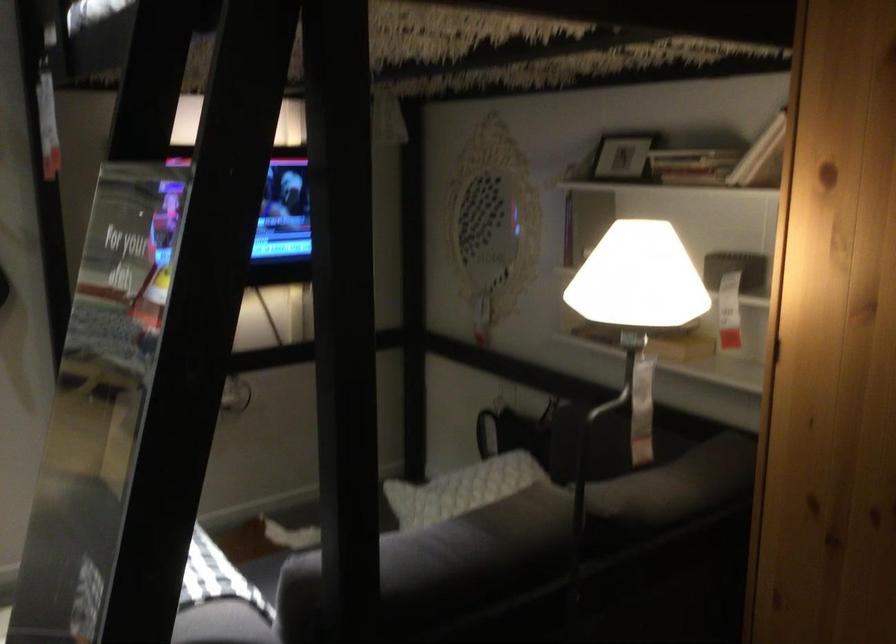
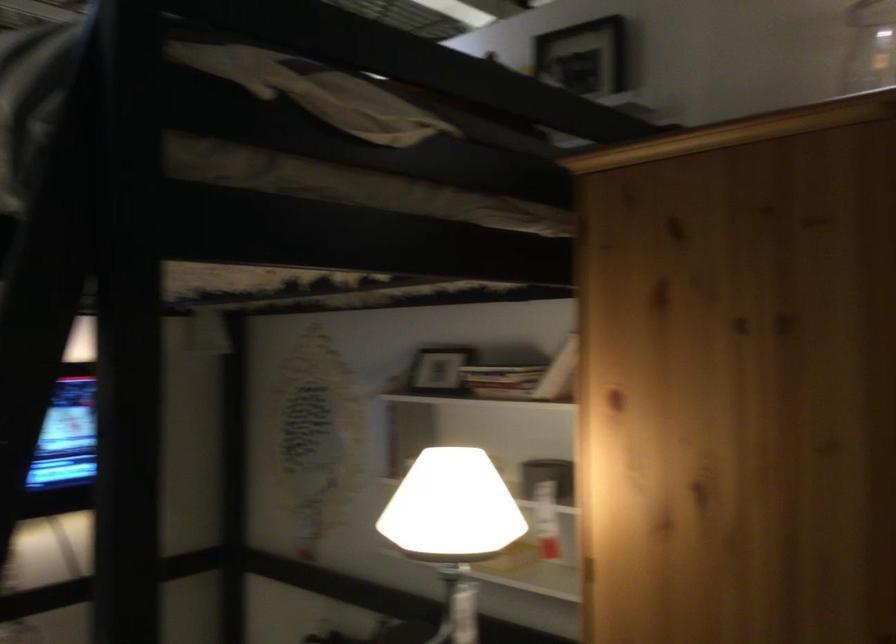
Where in the second image is the point corresponding to (x=617, y=158) from the first image?

(435, 372)